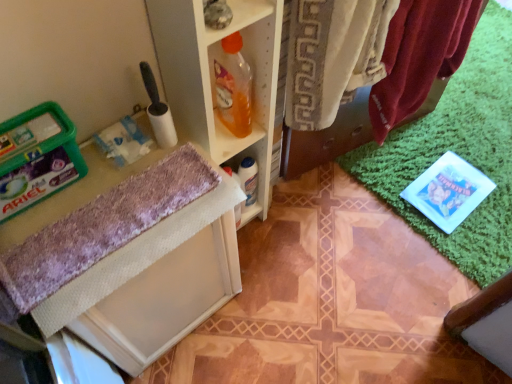
Question: Is translucent orange liquid at shelf center shorter than purple fuzzy bath towel at lower left?

Choices:
 (A) yes
 (B) no

Answer: (B)

Question: Is translucent orange liquid at shelf center behind purple fuzzy bath towel at lower left?

Choices:
 (A) yes
 (B) no

Answer: (A)

Question: Is translucent orange liquid at shelf center to the right of purple fuzzy bath towel at lower left from the viewer's perspective?

Choices:
 (A) no
 (B) yes

Answer: (B)

Question: Is purple fuzzy bath towel at lower left a part of translucent orange liquid at shelf center?

Choices:
 (A) no
 (B) yes

Answer: (A)

Question: Is translucent orange liquid at shelf center completely or partially outside of purple fuzzy bath towel at lower left?

Choices:
 (A) no
 (B) yes

Answer: (B)

Question: Considering the relative positions of translucent orange liquid at shelf center and purple fuzzy bath towel at lower left in the image provided, is translucent orange liquid at shelf center in front of purple fuzzy bath towel at lower left?

Choices:
 (A) no
 (B) yes

Answer: (A)

Question: Is translucent orange liquid at shelf center a part of velvet-like red towel at upper right?

Choices:
 (A) yes
 (B) no

Answer: (B)

Question: Does velvet-like red towel at upper right appear on the right side of translucent orange liquid at shelf center?

Choices:
 (A) yes
 (B) no

Answer: (A)

Question: Is velvet-like red towel at upper right not within translucent orange liquid at shelf center?

Choices:
 (A) yes
 (B) no

Answer: (A)

Question: Does velvet-like red towel at upper right have a greater width compared to translucent orange liquid at shelf center?

Choices:
 (A) yes
 (B) no

Answer: (A)

Question: Is velvet-like red towel at upper right closer to camera compared to translucent orange liquid at shelf center?

Choices:
 (A) yes
 (B) no

Answer: (A)

Question: From a real-world perspective, is velvet-like red towel at upper right located higher than translucent orange liquid at shelf center?

Choices:
 (A) no
 (B) yes

Answer: (A)

Question: From the image's perspective, does purple fuzzy bath towel at lower left appear lower than velvet-like red towel at upper right?

Choices:
 (A) yes
 (B) no

Answer: (A)